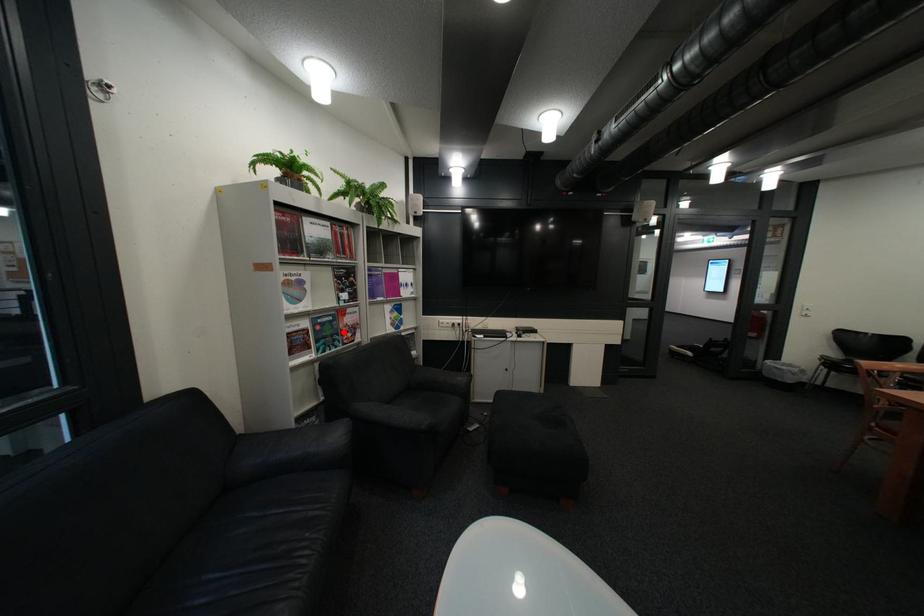
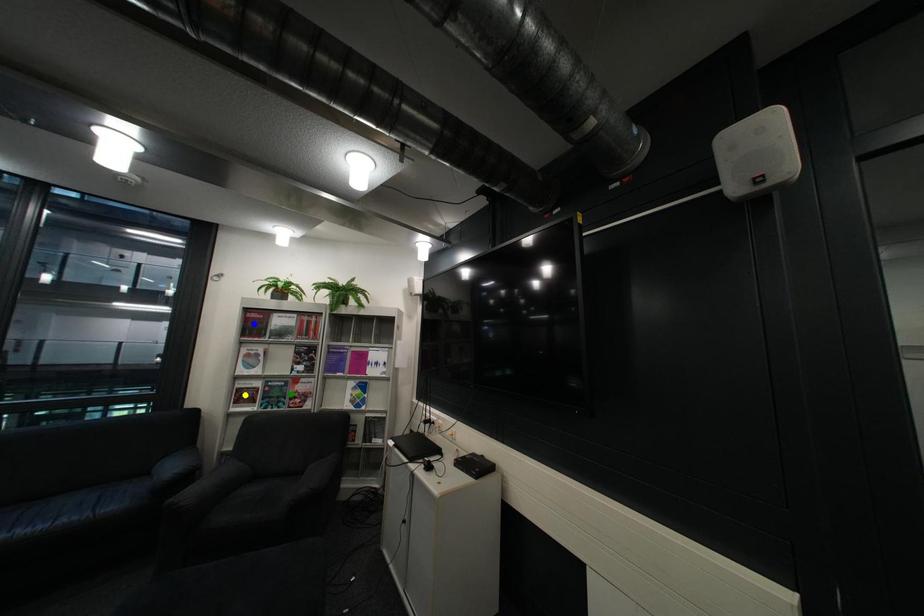
Question: I am providing you with two images of the same scene from different viewpoints. A red point is marked on the first image. You are given multiple points on the second image. Which spot in image 2 lines up with the point in image 1?

Choices:
 (A) green point
 (B) yellow point
 (C) blue point

Answer: (A)